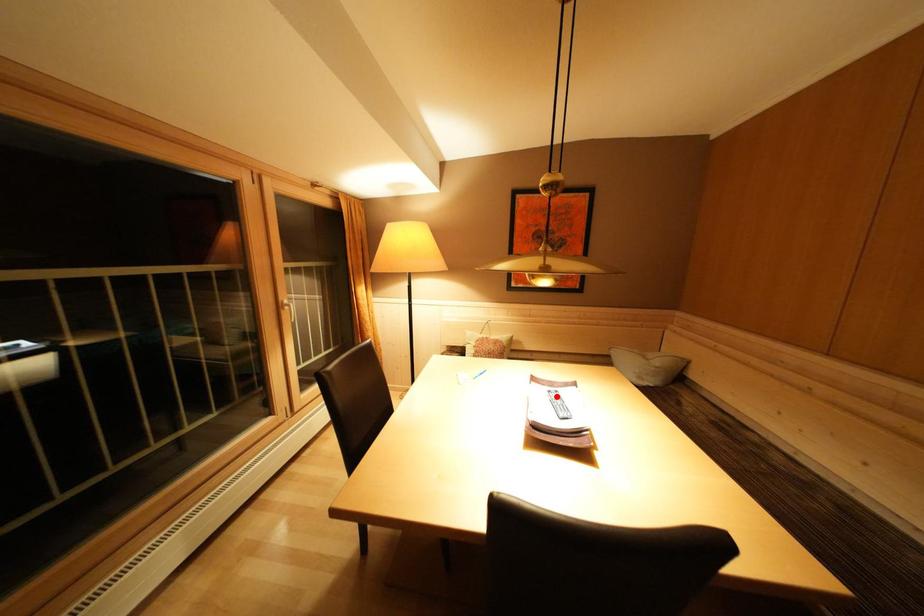
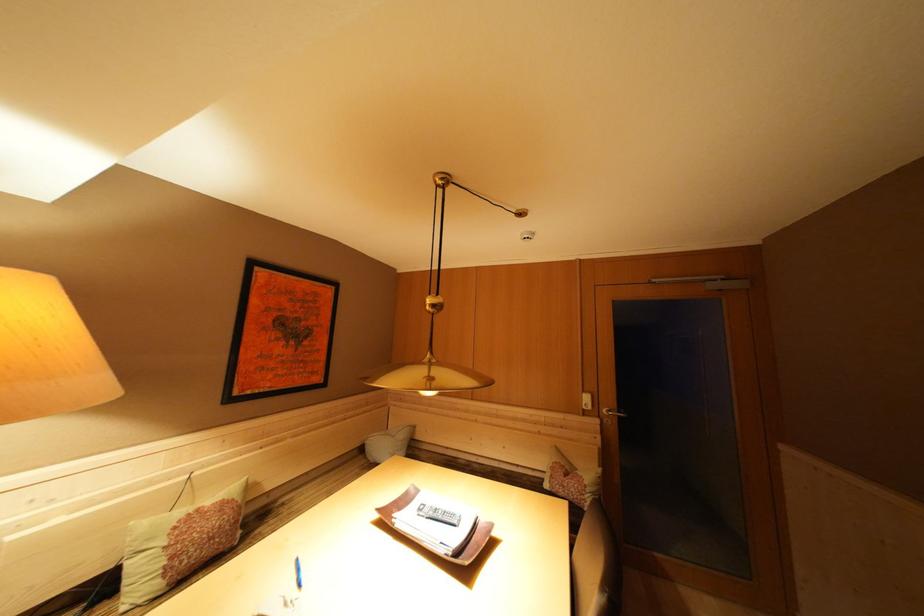
Question: I am providing you with two images of the same scene from different viewpoints. A red point is marked on the first image. Is the red point's position out of view in image 2?

Choices:
 (A) Yes
 (B) No

Answer: (B)